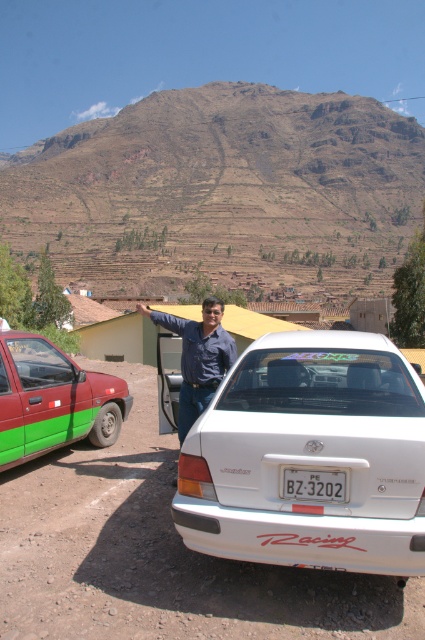
You are a driver trying to park your car in the dirt parking area. You see a white glossy sedan at center and a white plastic license plate at center. Which object is wider?

The white glossy sedan at center is wider than the white plastic license plate at center.

You are a tourist who just arrived at the mountain parking area. You see the green matte car at left and the white plastic license plate at center. Which object is closer to the ground?

The green matte car at left is located below the white plastic license plate at center, so the green matte car at left is closer to the ground.